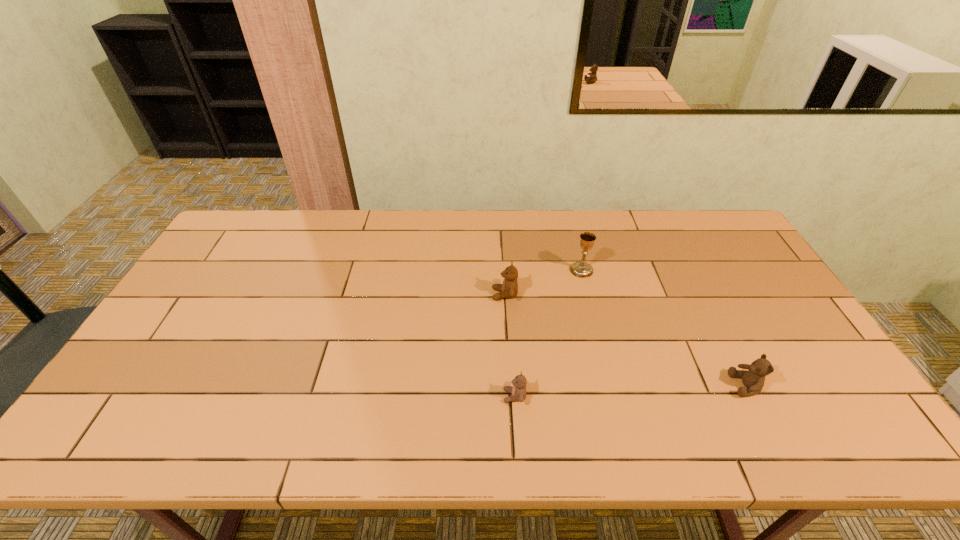
The image size is (960, 540). I want to click on vacant space situated 0.240m on the front-facing side of the rightmost object, so click(635, 386).

Find the location of a particular element. This screenshot has height=540, width=960. free location located 0.260m on the front-facing side of the rightmost object is located at coordinates (627, 386).

Where is `vacant space located on the front-facing side of the rightmost object`? Image resolution: width=960 pixels, height=540 pixels. vacant space located on the front-facing side of the rightmost object is located at coordinates [611, 386].

This screenshot has height=540, width=960. In order to click on vacant space positioned 0.400m on the front-facing side of the shortest object in this screenshot , I will do `click(339, 396)`.

I want to click on free spot located 0.290m on the front-facing side of the shortest object, so click(x=384, y=396).

Where is `free point located on the front-facing side of the shortest object`? free point located on the front-facing side of the shortest object is located at coordinates (445, 396).

This screenshot has width=960, height=540. What are the coordinates of `free region at the far edge of the desktop` in the screenshot? It's located at (379, 220).

You are a GUI agent. You are given a task and a screenshot of the screen. Output one action in this format:
    pyautogui.click(x=<x>, y=<y>)
    Task: Click on the free space at the left edge of the desktop
    This screenshot has width=960, height=540.
    Given the screenshot: What is the action you would take?
    pyautogui.click(x=147, y=396)

Where is `vacant space at the right edge of the desktop`? This screenshot has height=540, width=960. vacant space at the right edge of the desktop is located at coordinates (719, 273).

Where is `vacant space at the near left corner of the desktop`? vacant space at the near left corner of the desktop is located at coordinates (147, 428).